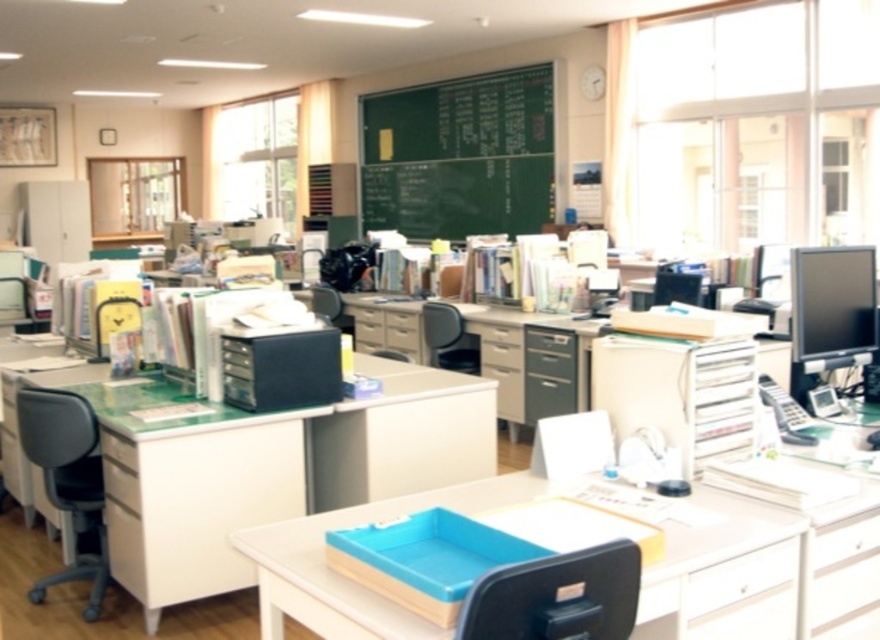
Question: Does white glossy drawer at center have a smaller size compared to matte plastic chair at center?

Choices:
 (A) yes
 (B) no

Answer: (A)

Question: Does black plastic swivel chair at center appear over matte black chair at center?

Choices:
 (A) no
 (B) yes

Answer: (A)

Question: Does gray fabric swivel chair at left appear under white glossy drawer at center?

Choices:
 (A) no
 (B) yes

Answer: (B)

Question: Which point appears closest to the camera in this image?

Choices:
 (A) (556, 576)
 (B) (570, 349)
 (C) (110, 465)
 (D) (407, 134)

Answer: (A)

Question: Based on their relative distances, which object is farther from the black plastic swivel chair at center?

Choices:
 (A) matte plastic chair at center
 (B) matte plastic tray at center
 (C) matte plastic table at center

Answer: (A)

Question: Among these points, which one is farthest from the camera?

Choices:
 (A) (551, 616)
 (B) (539, 340)

Answer: (B)